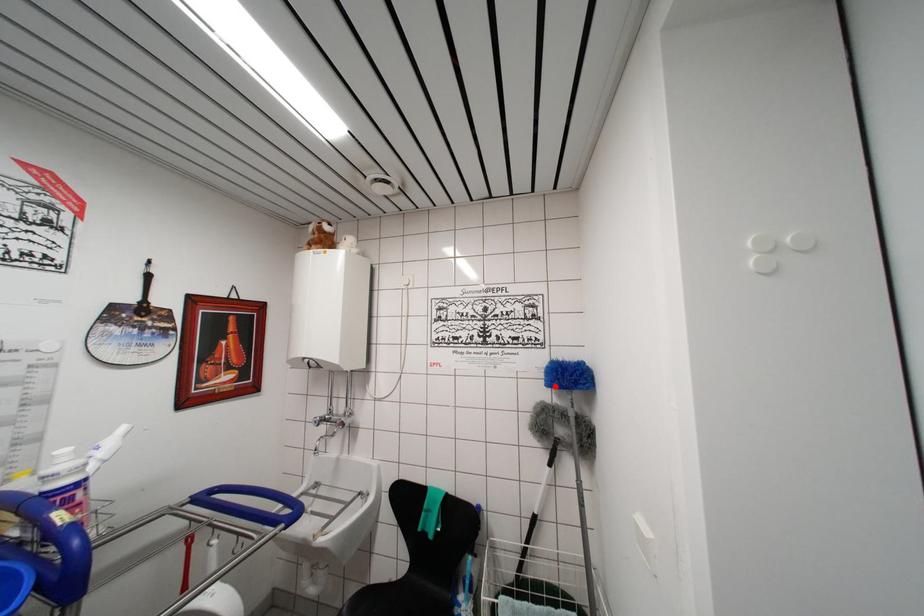
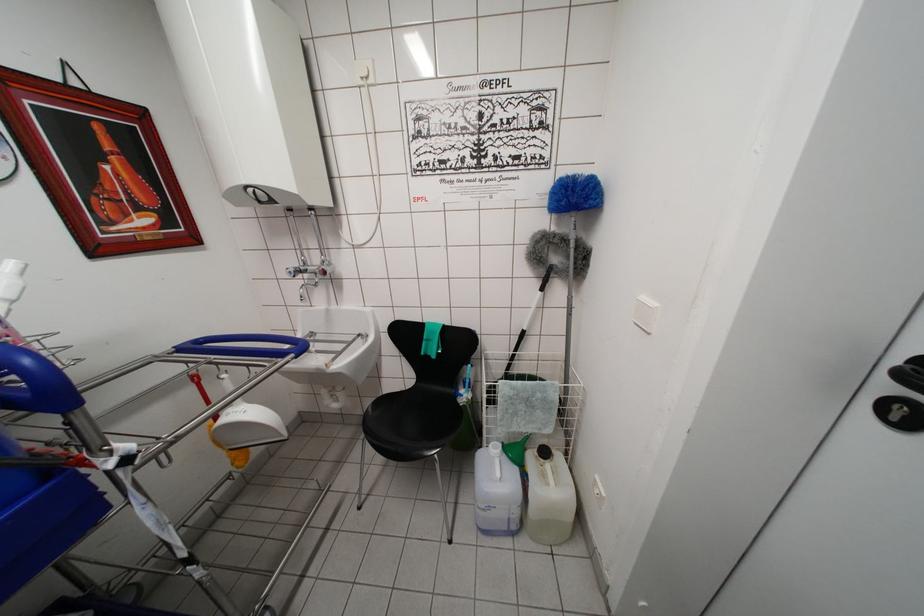
The point at the highlighted location is marked in the first image. Where is the corresponding point in the second image?

(562, 206)